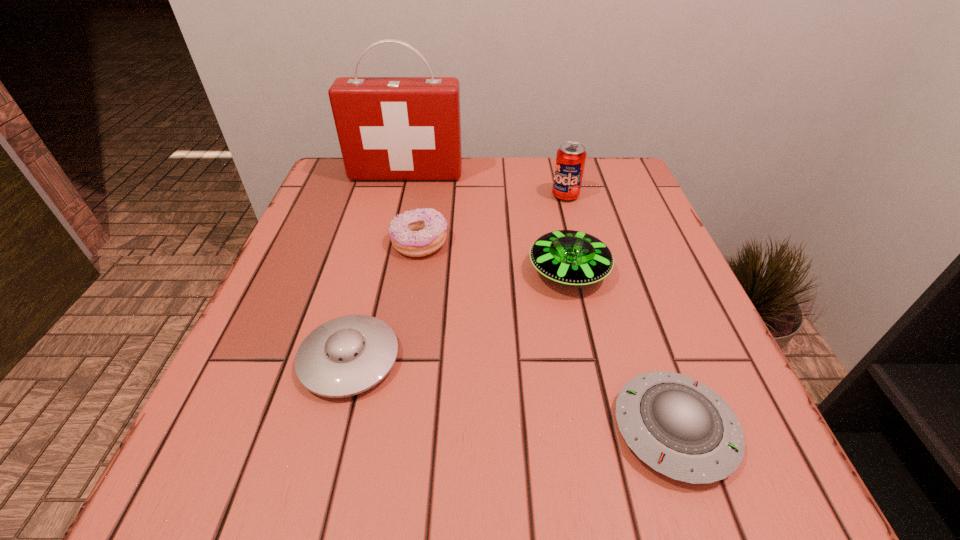
At what (x,y) coordinates should I click in order to perform the action: click on vacant space situated 0.290m on the back of the farthest saucer. Please return your answer as a coordinate pair (x, y). The height and width of the screenshot is (540, 960). Looking at the image, I should click on [547, 174].

You are a GUI agent. You are given a task and a screenshot of the screen. Output one action in this format:
    pyautogui.click(x=<x>, y=<y>)
    Task: Click on the vacant space positioned on the front of the doughnut
    
    Given the screenshot: What is the action you would take?
    pyautogui.click(x=402, y=350)

I want to click on vacant area situated on the back of the leftmost saucer, so click(389, 210).

I want to click on the first-aid kit situated at the far edge, so coord(389,128).

The width and height of the screenshot is (960, 540). Identify the location of soda can that is at the far edge. (x=570, y=160).

Where is `object that is at the near edge`? object that is at the near edge is located at coordinates (681, 428).

Where is `the first-aid kit that is at the left edge`? This screenshot has height=540, width=960. the first-aid kit that is at the left edge is located at coordinates (389, 128).

Where is `saucer that is at the left edge`? Image resolution: width=960 pixels, height=540 pixels. saucer that is at the left edge is located at coordinates (348, 355).

In order to click on soda can located at the right edge in this screenshot , I will do `click(570, 160)`.

Locate an element on the screen. object located in the far left corner section of the desktop is located at coordinates (389, 128).